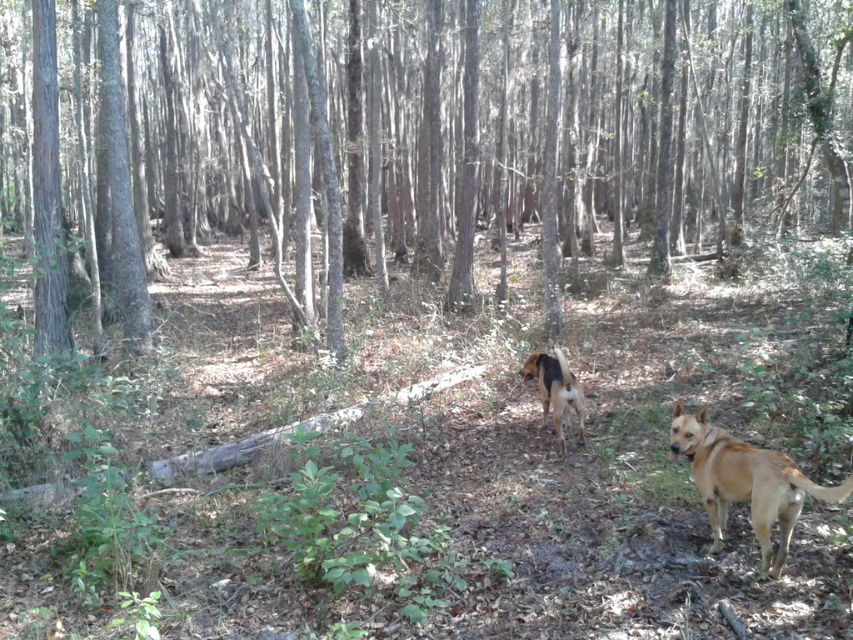
Question: Which object appears farthest from the camera in this image?

Choices:
 (A) light brown fur dog at lower right
 (B) brown textured tree at center
 (C) brown furry dog at center

Answer: (B)

Question: Can you confirm if brown textured tree at center is positioned above brown furry dog at center?

Choices:
 (A) yes
 (B) no

Answer: (A)

Question: Which point is farther from the camera taking this photo?

Choices:
 (A) (763, 35)
 (B) (546, 413)

Answer: (A)

Question: Which of the following is the closest to the observer?

Choices:
 (A) (9, 145)
 (B) (544, 401)

Answer: (B)

Question: Is brown textured tree at center bigger than brown furry dog at center?

Choices:
 (A) yes
 (B) no

Answer: (A)

Question: Is brown textured tree at center above light brown fur dog at lower right?

Choices:
 (A) no
 (B) yes

Answer: (B)